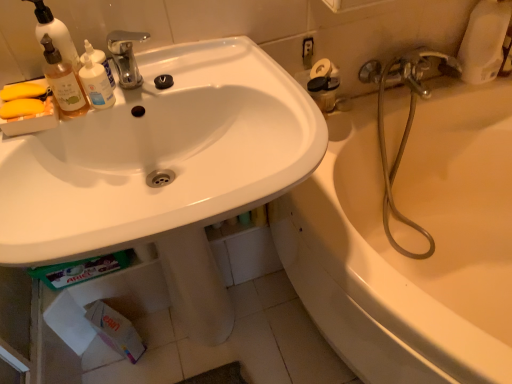
Identify the location of spots to the right of translucent glass bottle at upper left. Image resolution: width=512 pixels, height=384 pixels. (177, 75).